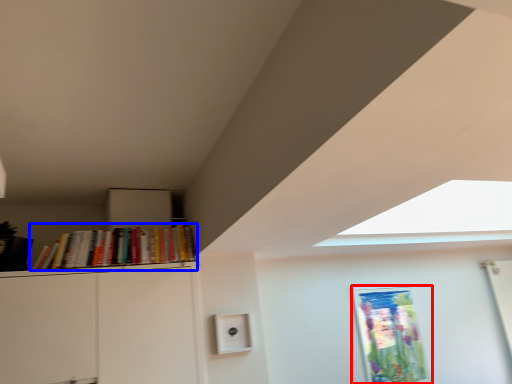
Question: Among these objects, which one is farthest to the camera, picture frame (highlighted by a red box) or book (highlighted by a blue box)?

Choices:
 (A) picture frame
 (B) book

Answer: (A)